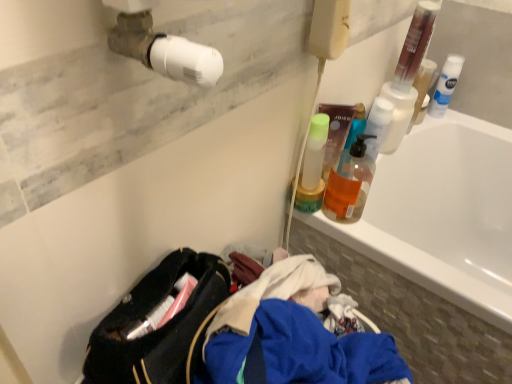
This screenshot has width=512, height=384. What are the coordinates of `free spot to the right of white matte shaving cream can at upper right, which ranks as the 1th cleaning product in back-to-front order` in the screenshot? It's located at (473, 120).